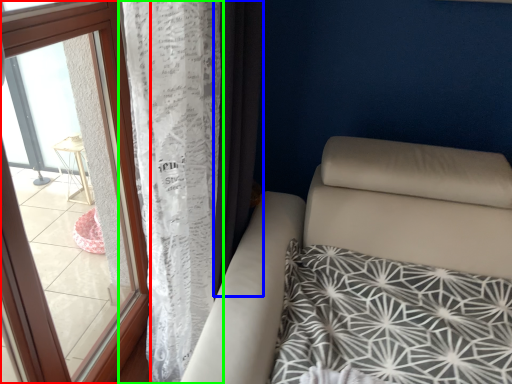
Question: Which is farther away from window (highlighted by a red box)? curtain (highlighted by a blue box) or curtain (highlighted by a green box)?

Choices:
 (A) curtain
 (B) curtain

Answer: (A)